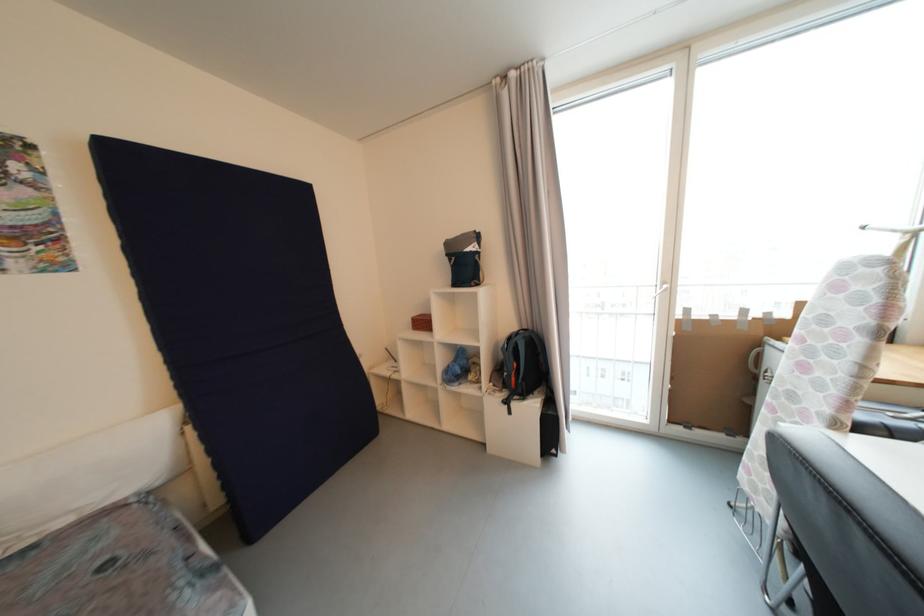
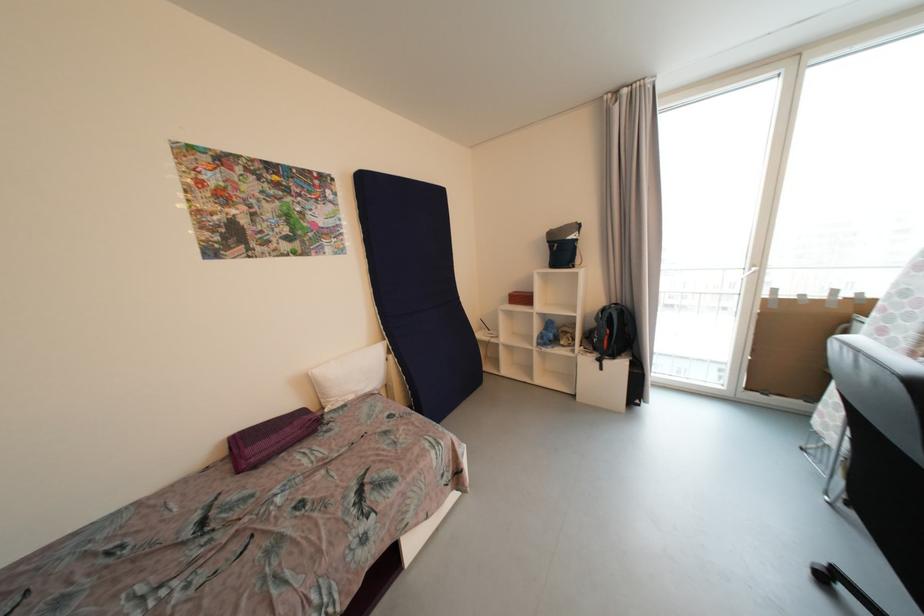
In the second image, find the point that corresponds to point (675, 424) in the first image.

(752, 390)